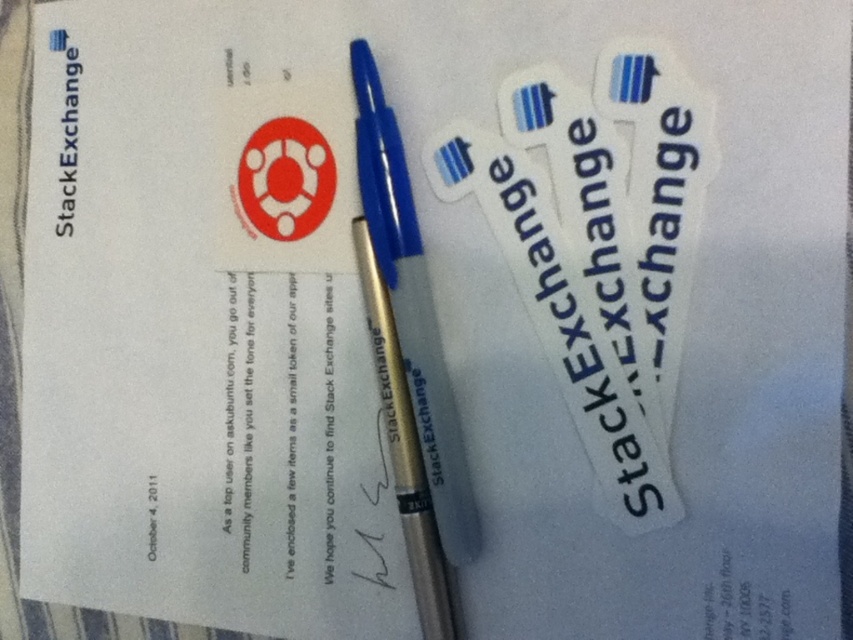
Does metallic gold pen at center have a lesser width compared to gold metallic fountain pen at center?

No.

Is point (403, 275) positioned behind point (390, 317)?

No.

Looking at this image, who is more distant from viewer, (432, 346) or (418, 456)?

Point (418, 456)

I want to click on metallic gold pen at center, so click(412, 308).

Is white paper stickers at upper right above metallic gold pen at center?

Incorrect, white paper stickers at upper right is not positioned above metallic gold pen at center.

Does white paper stickers at upper right appear on the left side of metallic gold pen at center?

In fact, white paper stickers at upper right is to the right of metallic gold pen at center.

I want to click on white paper stickers at upper right, so click(x=560, y=321).

Find the location of a particular element. This screenshot has width=853, height=640. white paper stickers at upper right is located at coordinates (560, 321).

Between point (648, 480) and point (422, 554), which one is positioned behind?

Positioned behind is point (422, 554).

Does point (642, 500) come closer to viewer compared to point (367, 296)?

Yes, it is.

The width and height of the screenshot is (853, 640). What are the coordinates of `white paper stickers at upper right` in the screenshot? It's located at (560, 321).